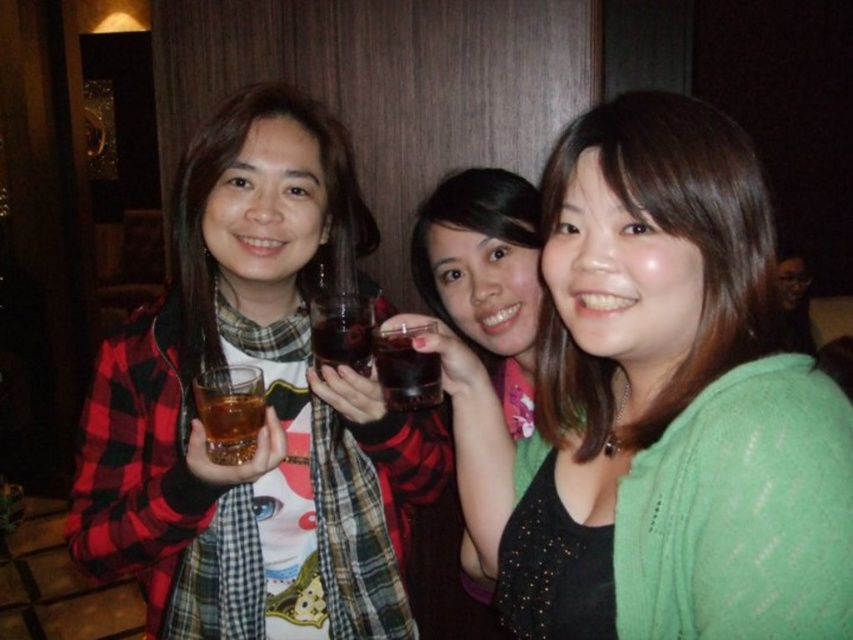
Is matte black shirt at center below translucent amber liquid at center?

Incorrect, matte black shirt at center is not positioned below translucent amber liquid at center.

Does matte black shirt at center have a greater width compared to translucent amber liquid at center?

Correct, the width of matte black shirt at center exceeds that of translucent amber liquid at center.

Between point (517, 198) and point (227, 451), which one is positioned in front?

Point (227, 451)

Locate an element on the screen. matte black shirt at center is located at coordinates tap(485, 275).

Can you confirm if translucent amber liquid at center is positioned to the right of translucent glass at center?

No, translucent amber liquid at center is not to the right of translucent glass at center.

Where is `translucent amber liquid at center`? The height and width of the screenshot is (640, 853). translucent amber liquid at center is located at coordinates (230, 412).

Which of these two, green matte sweater at center or matte black shirt at center, stands shorter?

With less height is green matte sweater at center.

Between point (723, 342) and point (461, 209), which one is positioned in front?

Point (723, 342) is in front.

At what (x,y) coordinates should I click in order to perform the action: click on green matte sweater at center. Please return your answer as a coordinate pair (x, y). The image size is (853, 640). Looking at the image, I should click on (685, 225).